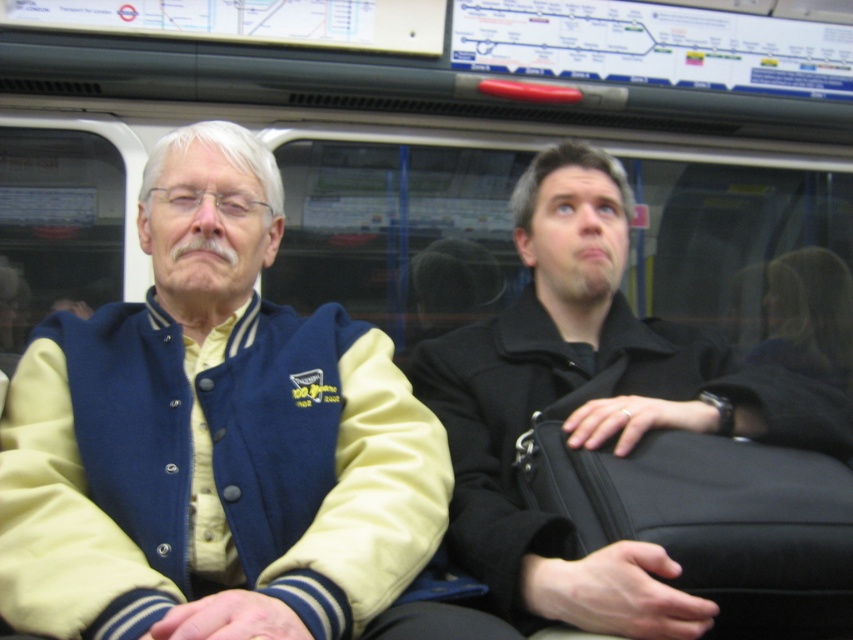
Question: Can you confirm if varnished leather jacket at center is positioned to the left of black leather jacket at center?

Choices:
 (A) no
 (B) yes

Answer: (B)

Question: Considering the real-world distances, which object is closest to the black fabric suitcase at right?

Choices:
 (A) varnished leather jacket at center
 (B) black leather jacket at center

Answer: (B)

Question: Which point appears closest to the camera in this image?

Choices:
 (A) (181, 273)
 (B) (614, 504)

Answer: (B)

Question: Can you confirm if varnished leather jacket at center is positioned above black leather jacket at center?

Choices:
 (A) yes
 (B) no

Answer: (A)

Question: Among these objects, which one is nearest to the camera?

Choices:
 (A) black leather jacket at center
 (B) varnished leather jacket at center

Answer: (B)

Question: Can you confirm if varnished leather jacket at center is smaller than black fabric suitcase at right?

Choices:
 (A) yes
 (B) no

Answer: (B)